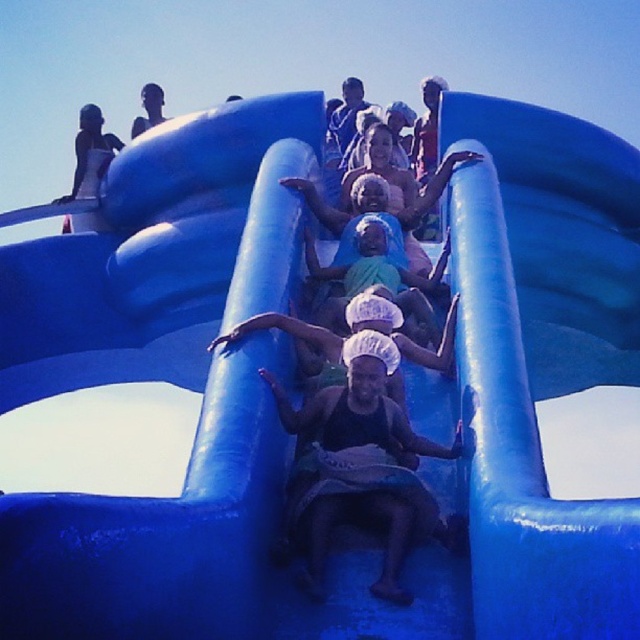
Question: Is matte black towel at center thinner than matte white swimsuit at upper left?

Choices:
 (A) yes
 (B) no

Answer: (B)

Question: Is matte black towel at center below matte white swimsuit at upper left?

Choices:
 (A) no
 (B) yes

Answer: (B)

Question: Considering the real-world distances, which object is farthest from the matte black person at upper center?

Choices:
 (A) matte white swimsuit at upper left
 (B) matte black towel at center

Answer: (B)

Question: Is matte white swimsuit at upper left to the left of matte black person at upper center from the viewer's perspective?

Choices:
 (A) no
 (B) yes

Answer: (B)

Question: Considering the real-world distances, which object is farthest from the matte black towel at center?

Choices:
 (A) matte white swimsuit at upper left
 (B) matte black person at upper center

Answer: (B)

Question: Which of these objects is positioned closest to the matte black towel at center?

Choices:
 (A) matte white swimsuit at upper left
 (B) matte black person at upper center

Answer: (A)